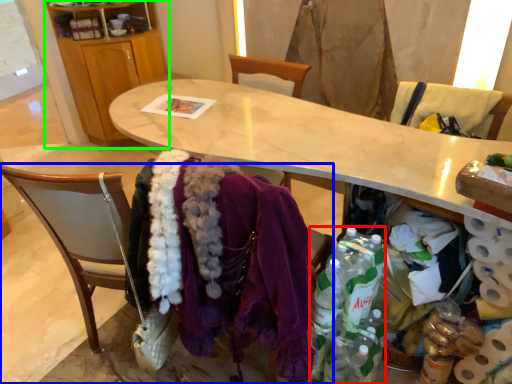
Question: Which object is positioned farthest from bottle (highlighted by a red box)? Select from chair (highlighted by a blue box) and cabinetry (highlighted by a green box).

Choices:
 (A) chair
 (B) cabinetry

Answer: (B)